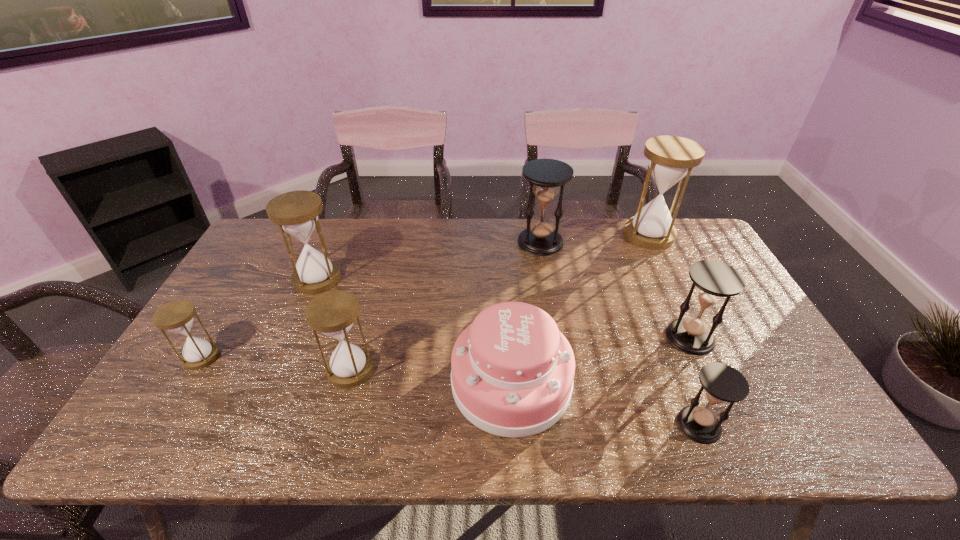
Where is `free location located 0.120m on the front of the leftmost object`? Image resolution: width=960 pixels, height=540 pixels. free location located 0.120m on the front of the leftmost object is located at coordinates (167, 413).

Locate an element on the screen. The width and height of the screenshot is (960, 540). vacant point located on the left of the smallest black hourglass is located at coordinates (509, 425).

I want to click on birthday cake that is at the near edge, so click(512, 370).

Image resolution: width=960 pixels, height=540 pixels. Find the location of `hourglass located in the near edge section of the desktop`. hourglass located in the near edge section of the desktop is located at coordinates (722, 383).

This screenshot has height=540, width=960. I want to click on object at the left edge, so click(177, 316).

At what (x,y) coordinates should I click in order to perform the action: click on object present at the far right corner. Please return your answer as a coordinate pair (x, y). This screenshot has height=540, width=960. Looking at the image, I should click on (671, 158).

You are a GUI agent. You are given a task and a screenshot of the screen. Output one action in this format:
    pyautogui.click(x=<x>, y=<y>)
    Task: Click on the vacant space at the far edge of the desktop
    The height and width of the screenshot is (540, 960).
    Given the screenshot: What is the action you would take?
    497,247

Locate an element on the screen. The width and height of the screenshot is (960, 540). vacant space at the near edge is located at coordinates (372, 441).

You are a GUI agent. You are given a task and a screenshot of the screen. Output one action in this format:
    pyautogui.click(x=<x>, y=<y>)
    Task: Click on the blank space at the left edge
    
    Given the screenshot: What is the action you would take?
    pyautogui.click(x=242, y=282)

This screenshot has height=540, width=960. Identify the location of vacant area at the right edge. (781, 387).